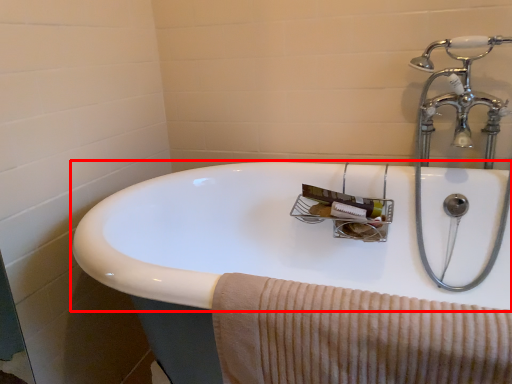
Question: Considering the relative positions of sink (annotated by the red box) and bath towel in the image provided, where is sink (annotated by the red box) located with respect to the staircase?

Choices:
 (A) right
 (B) left

Answer: (A)